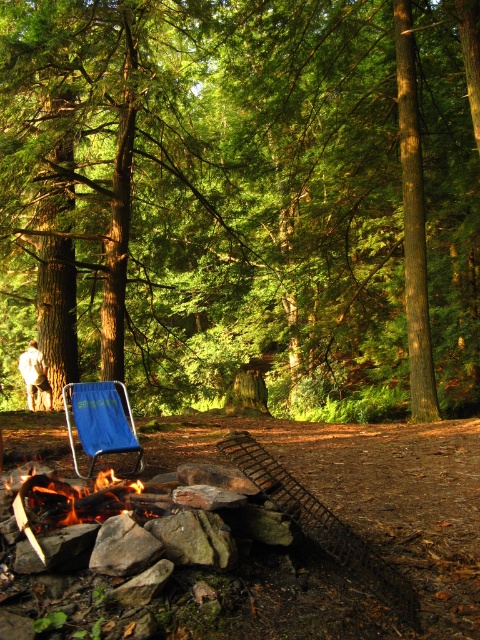
Question: Is brown wood tree at center closer to the viewer compared to flaming wood fire at lower left?

Choices:
 (A) yes
 (B) no

Answer: (B)

Question: Which of the following is the farthest from the observer?

Choices:
 (A) (87, 388)
 (B) (146, 234)
 (C) (111, 476)

Answer: (B)

Question: Is flaming wood fire at lower left positioned at the back of blue fabric chair at center?

Choices:
 (A) yes
 (B) no

Answer: (B)

Question: Does brown wood tree at center appear under flaming wood fire at lower left?

Choices:
 (A) no
 (B) yes

Answer: (A)

Question: Which point is closer to the camera?

Choices:
 (A) click(79, 488)
 (B) click(159, 387)
 (C) click(104, 426)

Answer: (A)

Question: Which point is farther from the camera taking this photo?

Choices:
 (A) (337, 179)
 (B) (108, 419)

Answer: (A)